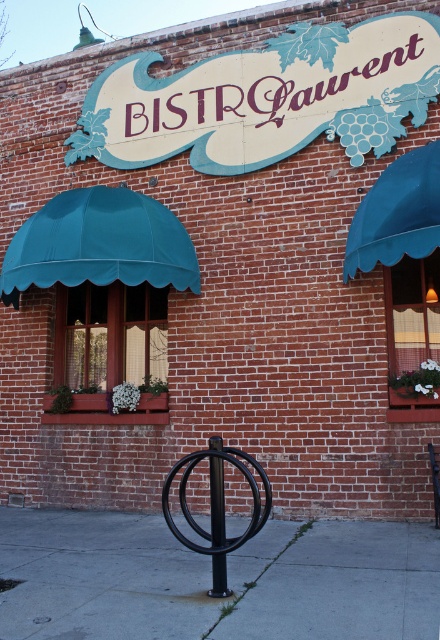
Question: Which of the following is the closest to the observer?

Choices:
 (A) (245, 579)
 (B) (143, 93)

Answer: (A)

Question: Can you confirm if gray concrete sidewalk at lower center is bigger than teal fabric awning at left?

Choices:
 (A) yes
 (B) no

Answer: (A)

Question: Which object appears farthest from the camera in this image?

Choices:
 (A) matte white sign at upper center
 (B) gray concrete sidewalk at lower center
 (C) teal fabric awning at left
 (D) black metal pole at center

Answer: (A)

Question: Which of the following is the closest to the observer?

Choices:
 (A) matte white sign at upper center
 (B) black metal pole at center
 (C) gray concrete sidewalk at lower center
 (D) teal fabric awning at left

Answer: (C)

Question: Does gray concrete sidewalk at lower center have a lesser width compared to black metal pole at center?

Choices:
 (A) yes
 (B) no

Answer: (B)

Question: Is teal fabric awning at left positioned before teal fabric awning at upper right?

Choices:
 (A) no
 (B) yes

Answer: (A)